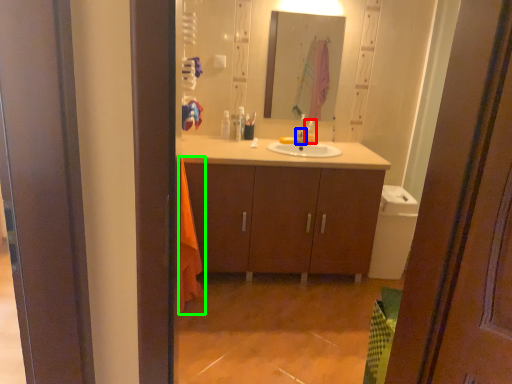
Question: Which object is positioned closest to toiletry (highlighted by a red box)? Select from tap (highlighted by a blue box) and beach towel (highlighted by a green box).

Choices:
 (A) tap
 (B) beach towel

Answer: (A)